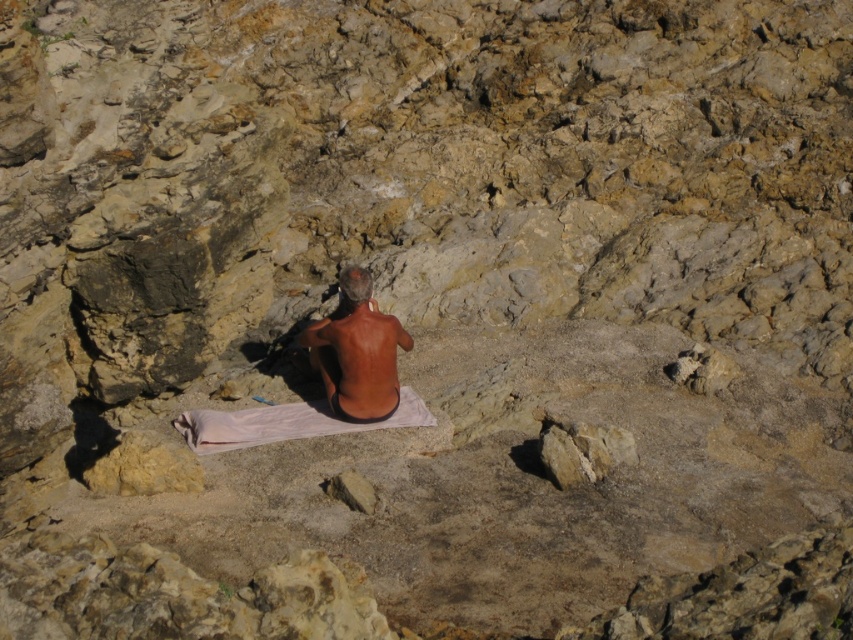
Question: Is brown matte skin at center positioned before white cloth at center?

Choices:
 (A) no
 (B) yes

Answer: (A)

Question: Where is brown matte skin at center located in relation to white cloth at center in the image?

Choices:
 (A) left
 (B) right

Answer: (B)

Question: Can you confirm if brown matte skin at center is thinner than white cloth at center?

Choices:
 (A) yes
 (B) no

Answer: (A)

Question: Which object is closer to the camera taking this photo?

Choices:
 (A) white cloth at center
 (B) brown matte skin at center

Answer: (A)